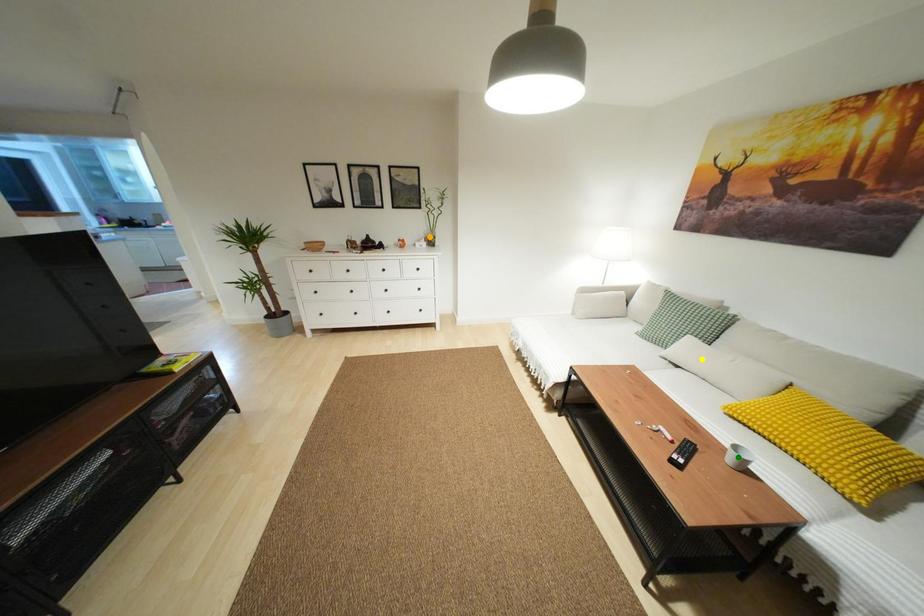
Order these from nearest to farthest:
1. orange point
2. green point
3. yellow point

1. green point
2. yellow point
3. orange point